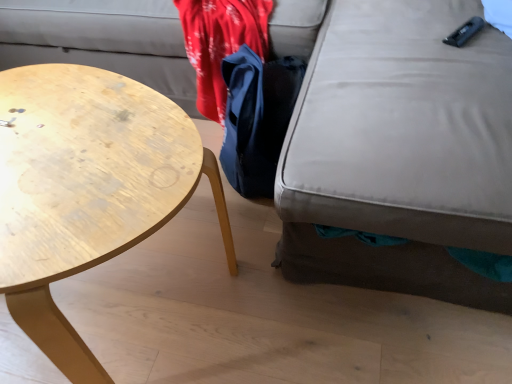
Question: Is matte gray swivel chair at lower right at the right side of wooden coffee table at left?

Choices:
 (A) yes
 (B) no

Answer: (A)

Question: Is matte gray swivel chair at lower right with wooden coffee table at left?

Choices:
 (A) yes
 (B) no

Answer: (B)

Question: From a real-world perspective, is matte gray swivel chair at lower right on wooden coffee table at left?

Choices:
 (A) yes
 (B) no

Answer: (A)

Question: Is matte gray swivel chair at lower right outside wooden coffee table at left?

Choices:
 (A) yes
 (B) no

Answer: (A)

Question: Is matte gray swivel chair at lower right to the left of wooden coffee table at left from the viewer's perspective?

Choices:
 (A) yes
 (B) no

Answer: (B)

Question: Is wooden coffee table at left completely or partially inside matte gray swivel chair at lower right?

Choices:
 (A) no
 (B) yes

Answer: (A)

Question: Is blue fabric bag at center thinner than matte gray swivel chair at lower right?

Choices:
 (A) no
 (B) yes

Answer: (B)

Question: Is blue fabric bag at center facing towards matte gray swivel chair at lower right?

Choices:
 (A) no
 (B) yes

Answer: (A)

Question: From the image's perspective, does blue fabric bag at center appear higher than matte gray swivel chair at lower right?

Choices:
 (A) yes
 (B) no

Answer: (B)

Question: Is blue fabric bag at center oriented away from matte gray swivel chair at lower right?

Choices:
 (A) no
 (B) yes

Answer: (B)

Question: Can you confirm if blue fabric bag at center is positioned to the right of matte gray swivel chair at lower right?

Choices:
 (A) no
 (B) yes

Answer: (A)

Question: Does blue fabric bag at center have a lesser height compared to matte gray swivel chair at lower right?

Choices:
 (A) yes
 (B) no

Answer: (A)

Question: Can you see matte gray swivel chair at lower right touching blue fabric bag at center?

Choices:
 (A) yes
 (B) no

Answer: (B)